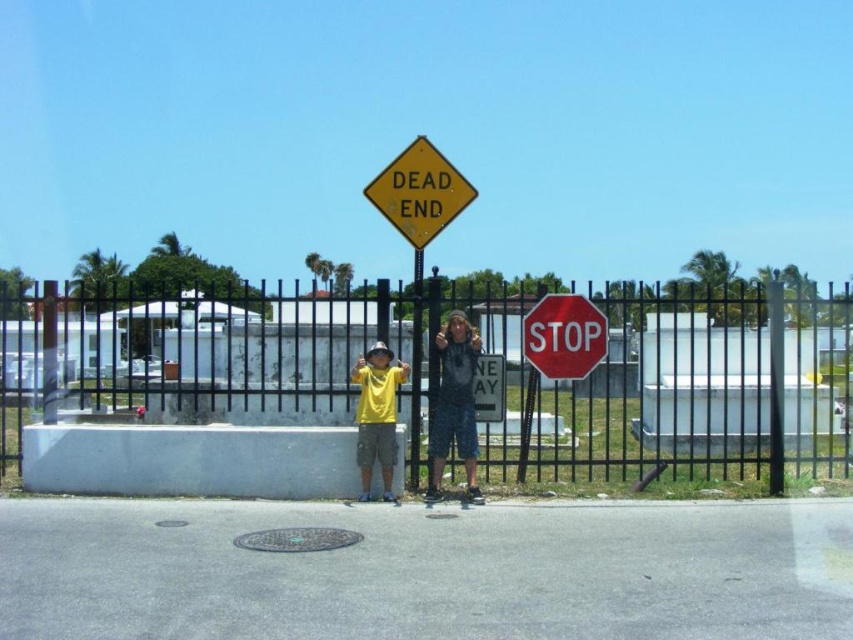
Between point (21, 433) and point (576, 321), which one is positioned in front?

Point (576, 321) is in front.

Who is more distant from viewer, [815,380] or [546,304]?

Positioned behind is point [815,380].

Is point (45, 374) positioned after point (570, 358)?

Yes.

Locate an element on the screen. This screenshot has height=640, width=853. black metal fence at center is located at coordinates coord(674,392).

Is black metal fence at center wider than yellow matte shirt at center?

Yes.

Is black metal fence at center shorter than yellow matte shirt at center?

No, black metal fence at center is not shorter than yellow matte shirt at center.

Is point (410, 481) farther from camera compared to point (358, 364)?

Yes, point (410, 481) is farther from viewer.

Locate an element on the screen. This screenshot has height=640, width=853. black metal fence at center is located at coordinates (674, 392).

Which is below, yellow diamond-shaped sign at center or denim shorts at center?

denim shorts at center is lower down.

Who is positioned more to the right, yellow diamond-shaped sign at center or denim shorts at center?

denim shorts at center is more to the right.

Is point (415, 156) positioned in front of point (450, 356)?

No, (415, 156) is further to viewer.

Locate an element on the screen. The image size is (853, 640). yellow diamond-shaped sign at center is located at coordinates (419, 193).